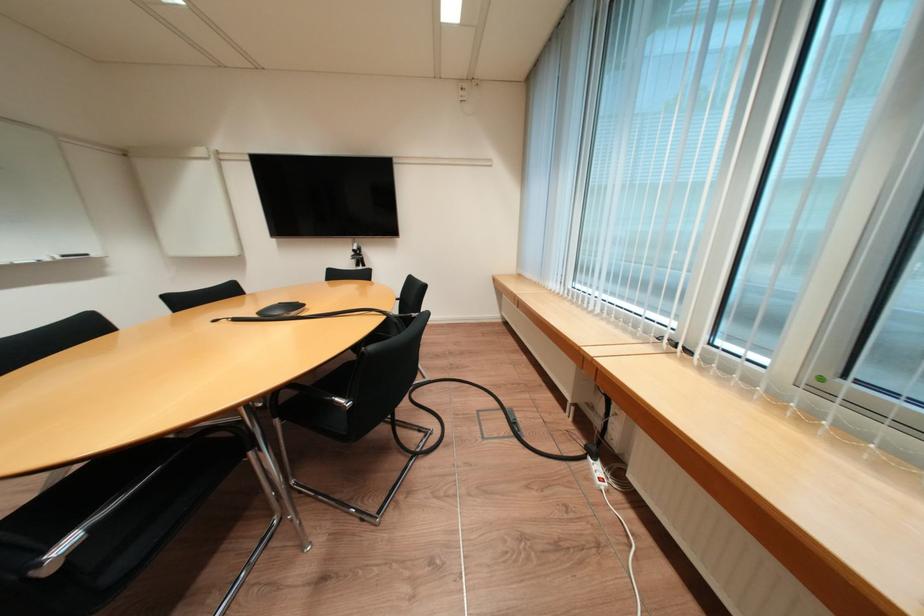
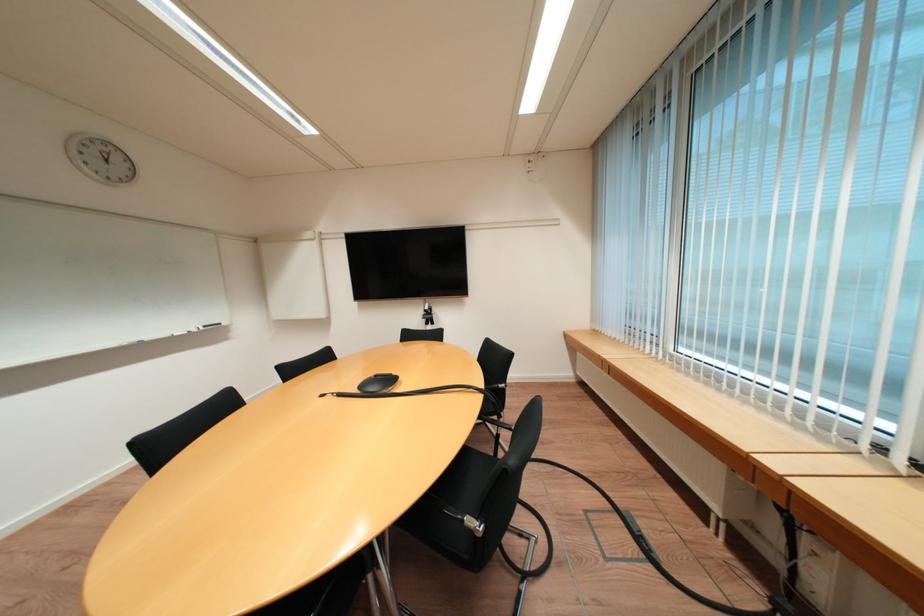
Question: How did the camera likely rotate?

Choices:
 (A) Left
 (B) Right
 (C) Up
 (D) Down

Answer: (C)